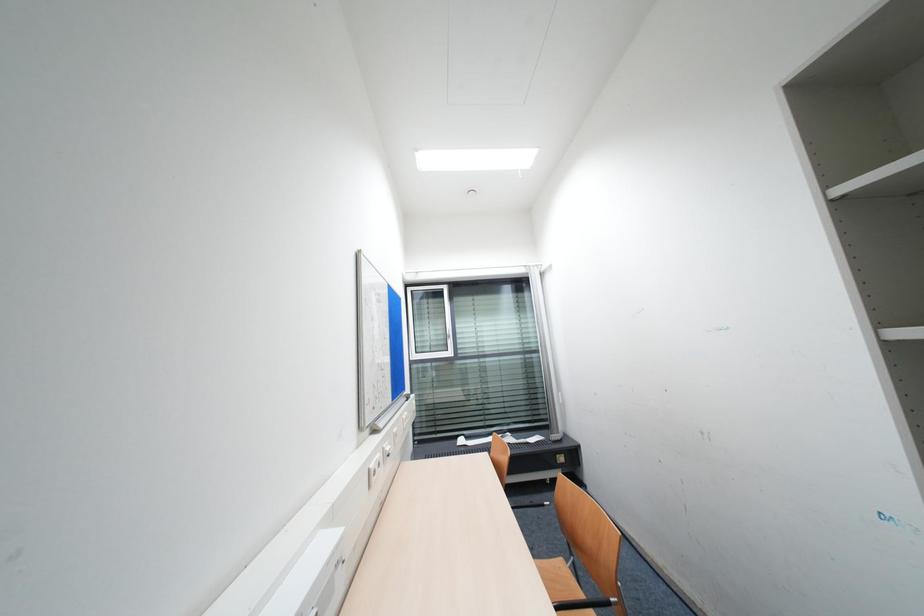
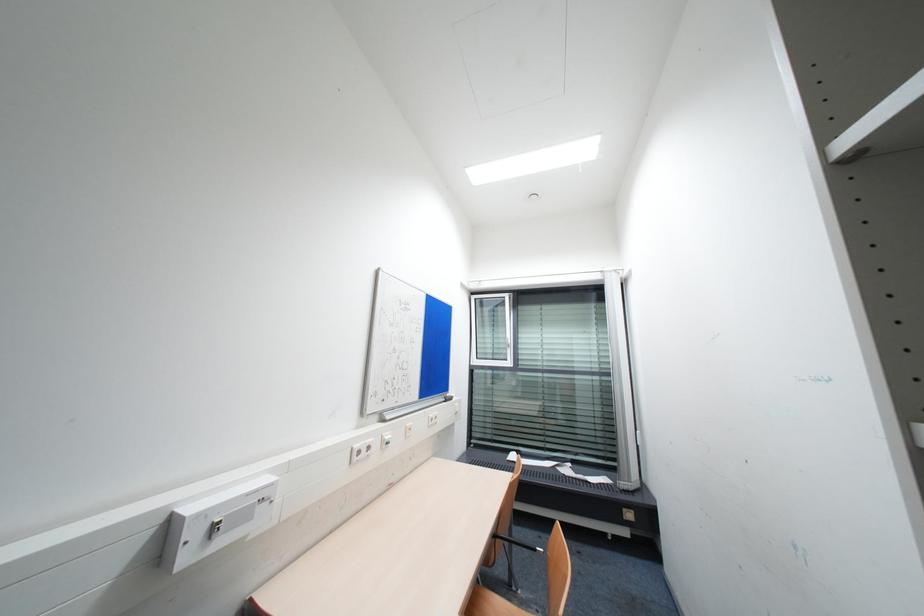
Question: The images are taken continuously from a first-person perspective. In which direction are you moving?

Choices:
 (A) Left
 (B) Right
 (C) Forward
 (D) Backward

Answer: (B)